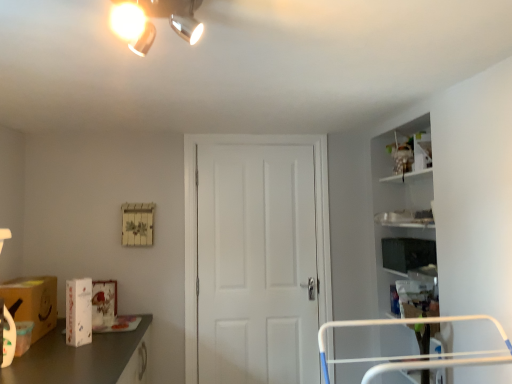
Question: Is white matte door at center at the left side of matte silver light fixture at upper center?

Choices:
 (A) yes
 (B) no

Answer: (B)

Question: Is white matte door at center further to camera compared to matte silver light fixture at upper center?

Choices:
 (A) yes
 (B) no

Answer: (A)

Question: Can you confirm if white matte door at center is taller than matte silver light fixture at upper center?

Choices:
 (A) no
 (B) yes

Answer: (B)

Question: Can you confirm if white matte door at center is wider than matte silver light fixture at upper center?

Choices:
 (A) yes
 (B) no

Answer: (B)

Question: Considering the relative sizes of white matte door at center and matte silver light fixture at upper center in the image provided, is white matte door at center shorter than matte silver light fixture at upper center?

Choices:
 (A) yes
 (B) no

Answer: (B)

Question: Considering the relative sizes of white matte door at center and matte silver light fixture at upper center in the image provided, is white matte door at center bigger than matte silver light fixture at upper center?

Choices:
 (A) yes
 (B) no

Answer: (A)

Question: Considering the relative sizes of white glossy box at lower left, placed as the first box when sorted from left to right, and matte brown cardboard box at lower left in the image provided, is white glossy box at lower left, placed as the first box when sorted from left to right, shorter than matte brown cardboard box at lower left?

Choices:
 (A) no
 (B) yes

Answer: (A)

Question: Is white glossy box at lower left, which is the 1th box from front to back, oriented away from matte brown cardboard box at lower left?

Choices:
 (A) yes
 (B) no

Answer: (A)

Question: Is the surface of white glossy box at lower left, arranged as the 2th box when viewed from the right, in direct contact with matte brown cardboard box at lower left?

Choices:
 (A) no
 (B) yes

Answer: (A)

Question: Is white glossy box at lower left, the second box when ordered from back to front, not close to matte brown cardboard box at lower left?

Choices:
 (A) yes
 (B) no

Answer: (B)

Question: Is white glossy box at lower left, the second box when ordered from back to front, smaller than matte brown cardboard box at lower left?

Choices:
 (A) no
 (B) yes

Answer: (B)

Question: Is white glossy box at lower left, positioned as the 2th box in top-to-bottom order, aimed at matte brown cardboard box at lower left?

Choices:
 (A) no
 (B) yes

Answer: (A)

Question: Is white matte door at center surrounding matte black tv at right, the 2th box from the bottom?

Choices:
 (A) no
 (B) yes

Answer: (A)